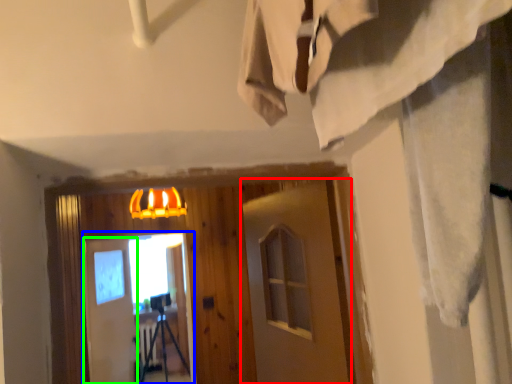
Question: Estimate the real-world distances between objects in this image. Which object is farther from barn door (highlighted by a red box), screen door (highlighted by a blue box) or barn door (highlighted by a green box)?

Choices:
 (A) screen door
 (B) barn door

Answer: (A)